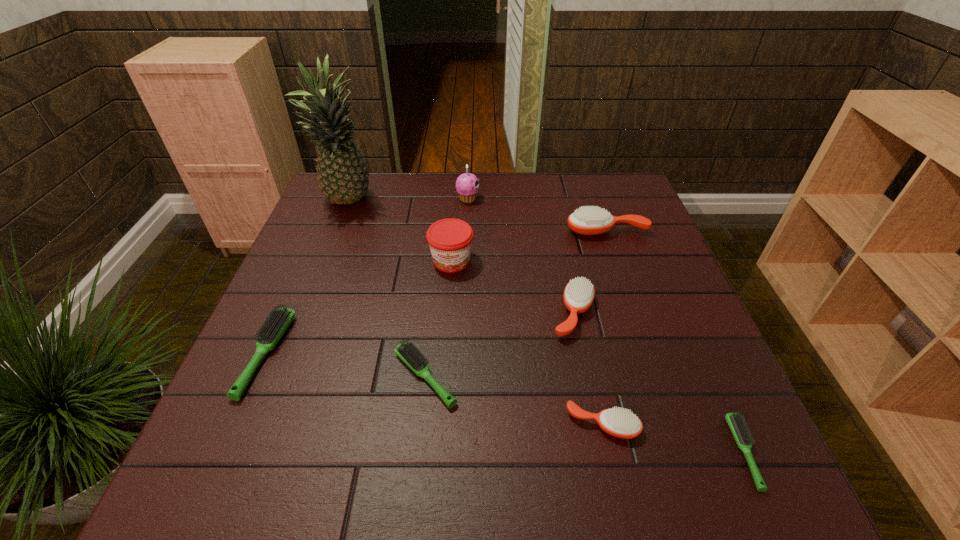
Where is `object present at the far left corner`? The width and height of the screenshot is (960, 540). object present at the far left corner is located at coordinates (343, 177).

This screenshot has height=540, width=960. I want to click on object located at the near right corner, so click(x=735, y=421).

Locate an element on the screen. The image size is (960, 540). vacant space at the far edge is located at coordinates (451, 205).

Where is `free space at the near edge`? The height and width of the screenshot is (540, 960). free space at the near edge is located at coordinates (449, 476).

At what (x,y) coordinates should I click in order to perform the action: click on vacant space at the right edge of the desktop. Please return your answer as a coordinate pair (x, y). This screenshot has height=540, width=960. Looking at the image, I should click on (653, 404).

Locate an element on the screen. The width and height of the screenshot is (960, 540). vacant area at the far left corner of the desktop is located at coordinates (358, 207).

Where is `free space at the far right corner of the desktop`? free space at the far right corner of the desktop is located at coordinates (616, 190).

Identify the location of vacant space at the near right corner. This screenshot has height=540, width=960. (712, 459).

The image size is (960, 540). In order to click on free space between the leftmost light hairbrush and the second light hairbrush from left to right in this screenshot , I will do `click(346, 365)`.

Where is `free space between the jam and the pineapple`? free space between the jam and the pineapple is located at coordinates (399, 231).